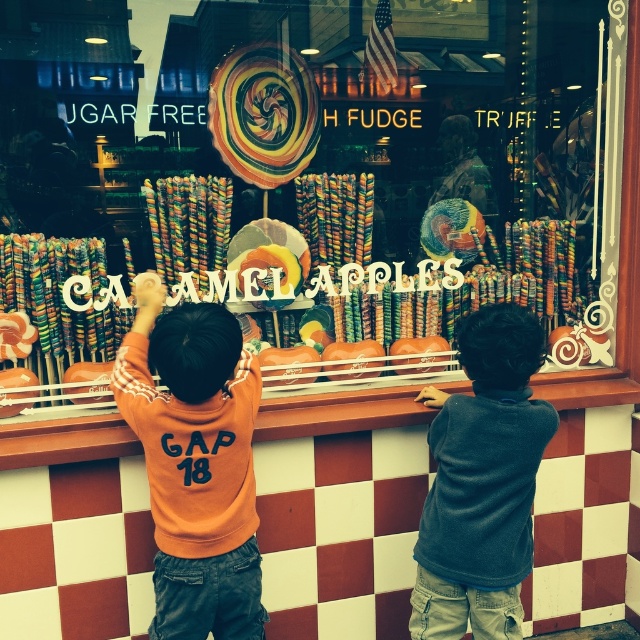
You are a photographer trying to capture the best angle of the candy store window. You notice two points marked on the window at coordinates point (426, 584) and point (227, 138). Which point should you focus on to ensure it appears larger in your photo?

Point (426, 584) is closer to the camera than point (227, 138), so focusing on point (426, 584) will make it appear larger in the photo.

You are a parent trying to decide whether to buy a dark gray sweater at center or a shiny metallic lollipop at center as a treat for your child. Based on the size difference between the two items, which one would you choose if you want something that takes up more space?

The dark gray sweater at center is wider than the shiny metallic lollipop at center, so you should choose the dark gray sweater at center if you want something that takes up more space.

You are a parent standing in front of the candy store window. You notice the dark gray sweater at center and the shiny metallic lollipop at center. Which object is taller?

The dark gray sweater at center is taller than the shiny metallic lollipop at center.